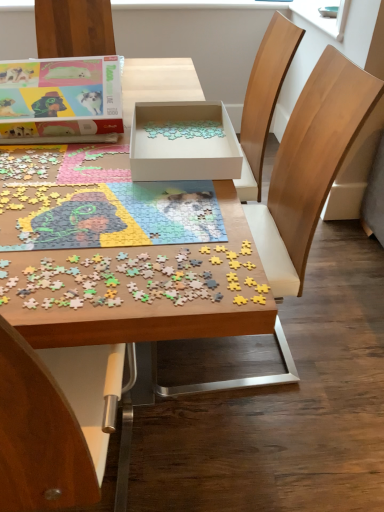
Where is `free spot above wooden puzzle pieces at center, acting as the 1th jigsaw puzzle starting from the top (from a real-world perspective)`? free spot above wooden puzzle pieces at center, acting as the 1th jigsaw puzzle starting from the top (from a real-world perspective) is located at coordinates (93, 186).